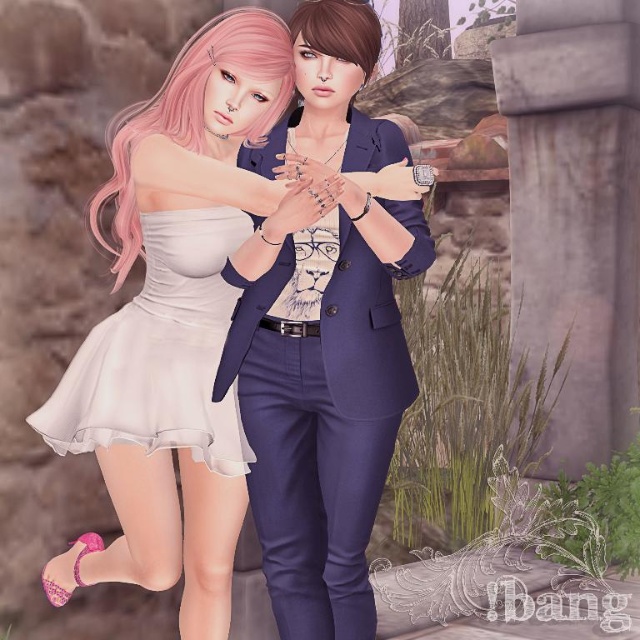
Question: Which point is closer to the camera?

Choices:
 (A) coord(324,346)
 (B) coord(244,84)
 (C) coord(234,392)

Answer: (B)

Question: Can you confirm if matte white dress at center is thinner than white satin dress at center?

Choices:
 (A) yes
 (B) no

Answer: (B)

Question: Which is nearer to the white satin dress at center?

Choices:
 (A) navy blue suit at center
 (B) matte white dress at center

Answer: (B)

Question: Is the position of matte white dress at center less distant than that of white satin dress at center?

Choices:
 (A) yes
 (B) no

Answer: (A)

Question: Is matte white dress at center above navy blue suit at center?

Choices:
 (A) yes
 (B) no

Answer: (A)

Question: Which point is farther from the camera taking this photo?

Choices:
 (A) (160, 442)
 (B) (301, 636)
 (C) (72, 445)

Answer: (C)